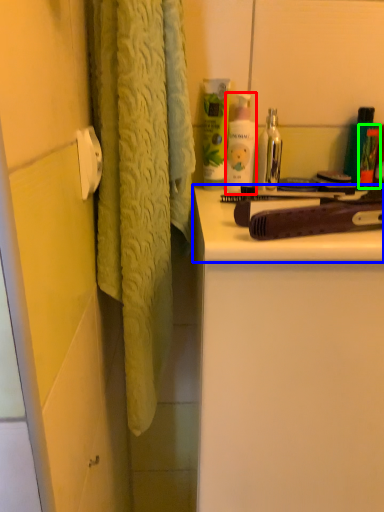
Question: Estimate the real-world distances between objects in this image. Which object is farther from toiletry (highlighted by a red box), counter top (highlighted by a blue box) or toiletry (highlighted by a green box)?

Choices:
 (A) counter top
 (B) toiletry

Answer: (A)